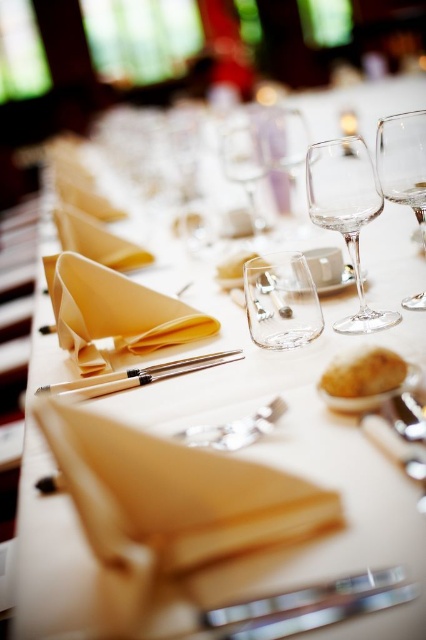
Question: Which object appears closest to the camera in this image?

Choices:
 (A) golden crumbly bread at center
 (B) transparent glass wine glass at center

Answer: (A)

Question: Does transparent glass wine glass at upper right lie behind wooden chopsticks at center?

Choices:
 (A) no
 (B) yes

Answer: (A)

Question: Considering the relative positions of transparent glass wine glass at center and wooden chopsticks at center in the image provided, where is transparent glass wine glass at center located with respect to wooden chopsticks at center?

Choices:
 (A) below
 (B) above

Answer: (B)

Question: Which of these objects is positioned closest to the transparent glass wine glass at center?

Choices:
 (A) transparent glass wine glass at upper right
 (B) wooden chopsticks at center
 (C) golden crumbly bread at center
 (D) translucent glass at center

Answer: (A)

Question: Does transparent glass wine glass at upper right have a greater width compared to golden crumbly bread at center?

Choices:
 (A) no
 (B) yes

Answer: (B)

Question: Which point is closer to the camera?

Choices:
 (A) (377, 385)
 (B) (420, 292)
 (C) (371, 176)

Answer: (A)